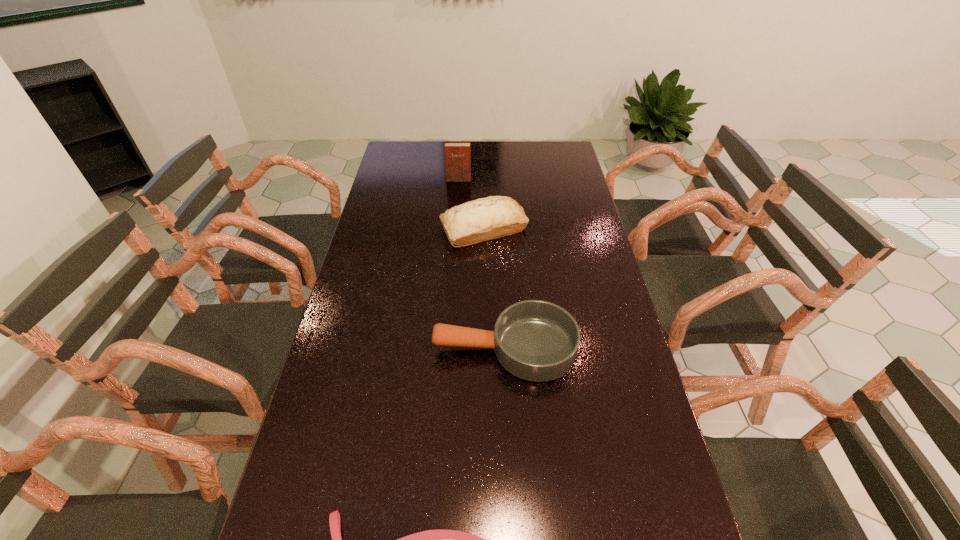
Where is `diary`? The height and width of the screenshot is (540, 960). diary is located at coordinates (457, 154).

Locate an element on the screen. This screenshot has width=960, height=540. the farthest object is located at coordinates (457, 154).

Find the location of `the second tallest object`. the second tallest object is located at coordinates (492, 217).

Locate an element on the screen. The image size is (960, 540). bread is located at coordinates (492, 217).

Locate an element on the screen. This screenshot has height=540, width=960. the second nearest object is located at coordinates (535, 340).

Locate an element on the screen. Image resolution: width=960 pixels, height=540 pixels. pan is located at coordinates (535, 340).

Locate an element on the screen. The width and height of the screenshot is (960, 540). free space located on the front cover of the tallest object is located at coordinates (455, 239).

At what (x,y) coordinates should I click in order to perform the action: click on free space located 0.180m on the front of the bread. Please return your answer as a coordinate pair (x, y). Looking at the image, I should click on (485, 287).

Locate an element on the screen. The height and width of the screenshot is (540, 960). free space located on the handle side of the second shortest object is located at coordinates [x=416, y=348].

At what (x,y) coordinates should I click in order to perform the action: click on free space located 0.230m on the handle side of the second shortest object. Please return your answer as a coordinate pair (x, y). The image size is (960, 540). Looking at the image, I should click on (350, 348).